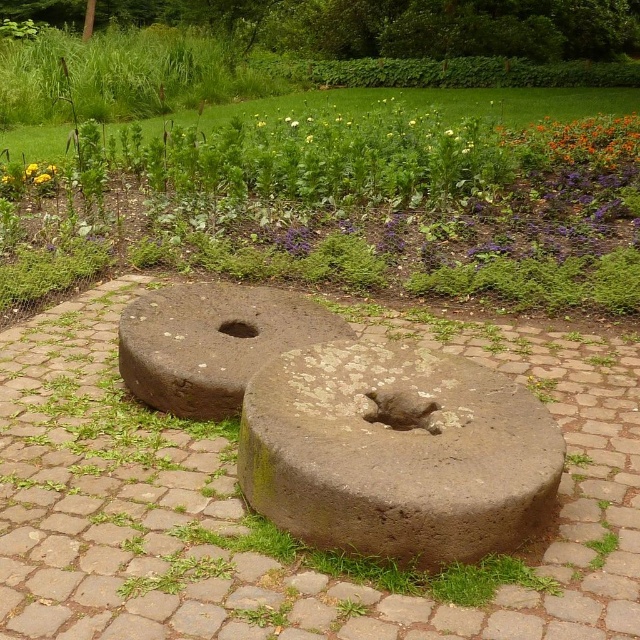
Question: Which object is closer to the camera taking this photo?

Choices:
 (A) green mossy stone at center
 (B) gray stone millstone at center

Answer: (B)

Question: Is brown stone millstones at center further to camera compared to green mossy stone at center?

Choices:
 (A) no
 (B) yes

Answer: (A)

Question: Which point is closer to the camera?

Choices:
 (A) (435, 365)
 (B) (262, 323)

Answer: (A)

Question: Which point is farther to the camera?

Choices:
 (A) (636, 371)
 (B) (244, 336)

Answer: (B)

Question: Can you confirm if brown stone millstones at center is positioned below brown stone hole at center?

Choices:
 (A) no
 (B) yes

Answer: (B)

Question: Does brown stone millstones at center have a greater width compared to gray stone millstone at center?

Choices:
 (A) no
 (B) yes

Answer: (B)